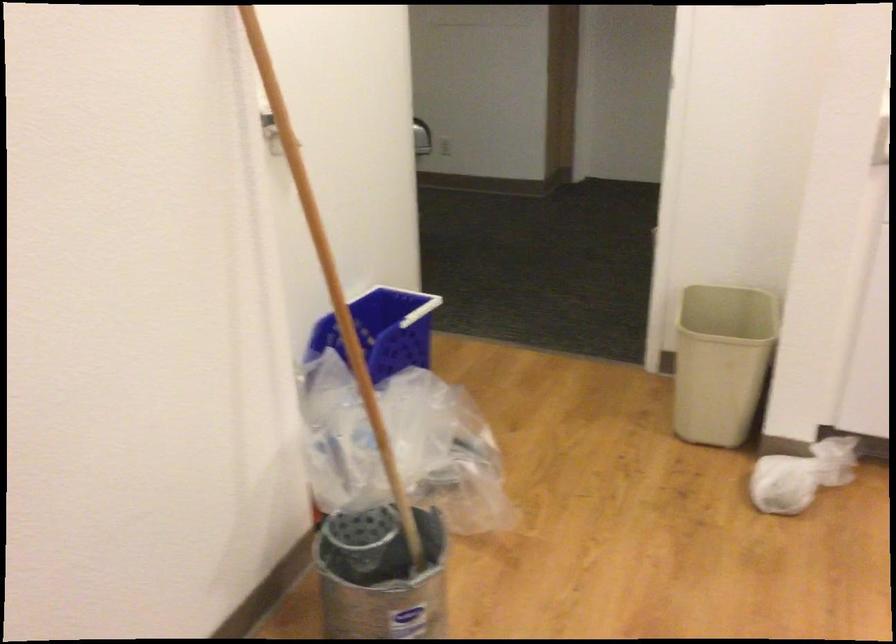
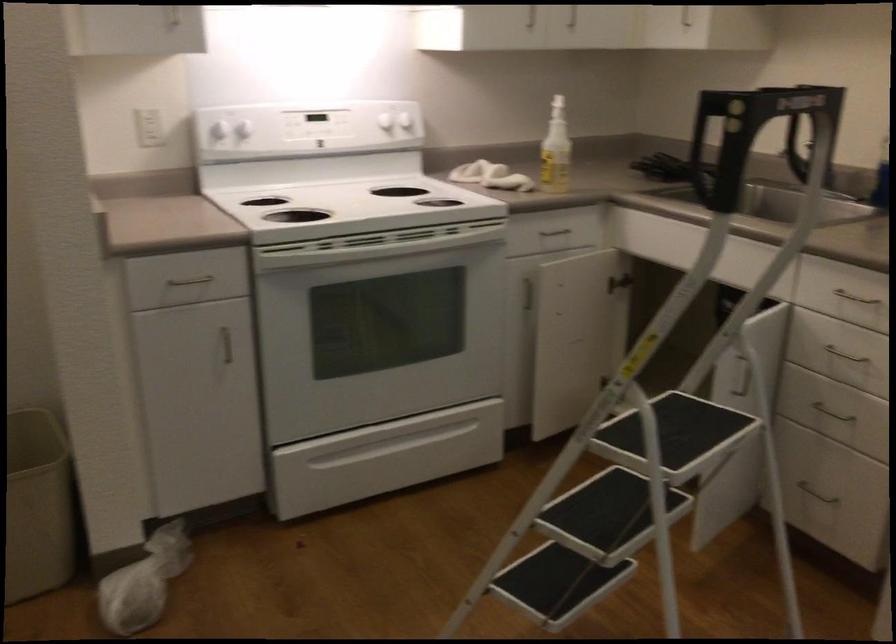
Where in the second image is the point corresponding to [739,365] from the first image?

(38, 506)